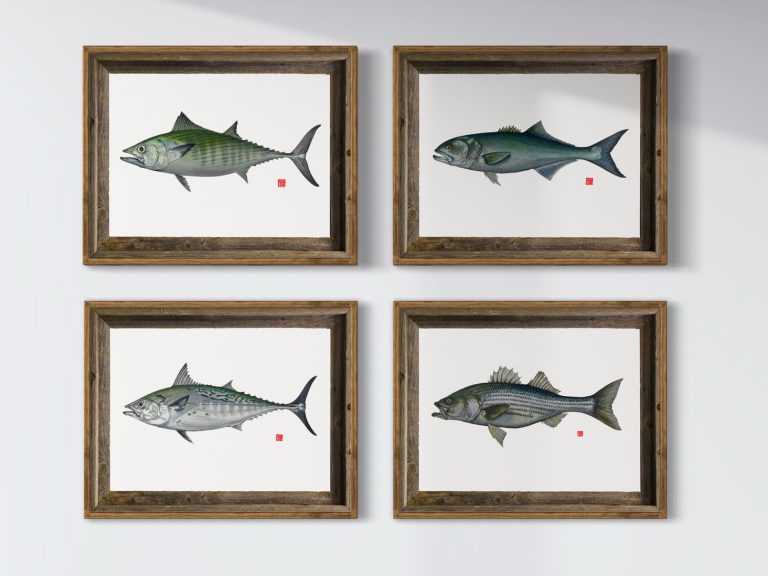
Locate an element on the screen. The image size is (768, 576). white wall is located at coordinates (32, 21), (739, 16), (32, 551), (730, 541).